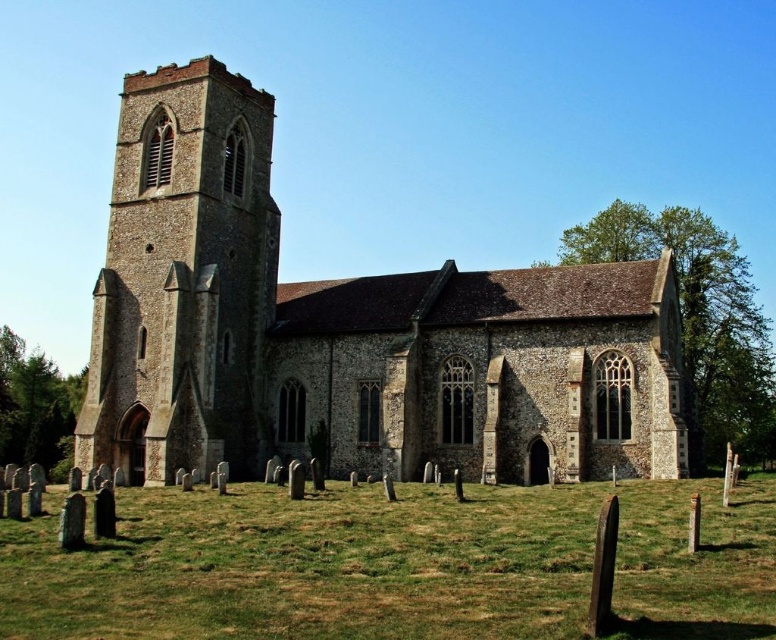
You are standing in the graveyard and want to place a new gravestone near the green grass at lower center. However, there is a shadow cast by the stone tower at left. Where should you place the gravestone to avoid the shadow?

The green grass at lower center is positioned under the stone tower at left, so placing the gravestone away from the area directly beneath the tower would avoid its shadow.

You are standing in front of the historic stone church and want to take a photo. You notice two points marked in the scene. The first point is at coordinates point (667, 429) and the second point is at point (220, 449). Which point is closer to your camera when taking the photo?

Point (667, 429) is closer to the camera than point (220, 449).